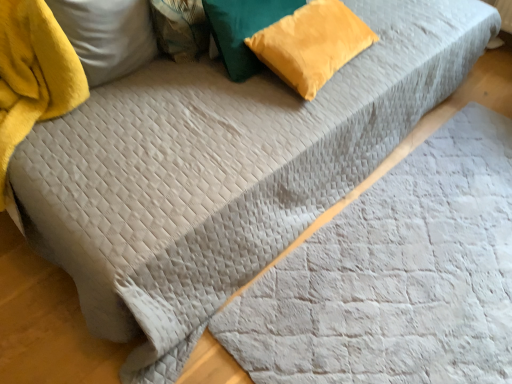
This screenshot has width=512, height=384. I want to click on gray quilted blanket at center, so click(x=396, y=276).

You are a GUI agent. You are given a task and a screenshot of the screen. Output one action in this format:
    pyautogui.click(x=<x>, y=<y>)
    Task: Click on the velvet yellow pillow at upper right, which is the first pillow from right to left
    
    Given the screenshot: What is the action you would take?
    pyautogui.click(x=311, y=44)

The height and width of the screenshot is (384, 512). I want to click on gray quilted blanket at center, so click(x=396, y=276).

Relative to gray quilted blanket at center, is velvet yellow pillow at upper right, positioned as the third pillow in left-to-right order, in front or behind?

velvet yellow pillow at upper right, positioned as the third pillow in left-to-right order, is behind gray quilted blanket at center.

Can you tell me how much velvet yellow pillow at upper right, which is the first pillow from right to left, and gray quilted blanket at center differ in facing direction?

173 degrees.

Does velvet yellow pillow at upper right, positioned as the third pillow in left-to-right order, turn towards gray quilted blanket at center?

No, velvet yellow pillow at upper right, positioned as the third pillow in left-to-right order, is not turned towards gray quilted blanket at center.

Choose the correct answer: Is velvet yellow pillow at upper right, positioned as the third pillow in left-to-right order, inside gray quilted blanket at center or outside it?

velvet yellow pillow at upper right, positioned as the third pillow in left-to-right order, is outside gray quilted blanket at center.

Considering the sizes of objects velvet yellow pillow at upper center, the 2th pillow in the left-to-right sequence, and yellow velvet pillow at upper left, acting as the 1th pillow starting from the left, in the image provided, who is thinner, velvet yellow pillow at upper center, the 2th pillow in the left-to-right sequence, or yellow velvet pillow at upper left, acting as the 1th pillow starting from the left,?

Thinner between the two is velvet yellow pillow at upper center, the 2th pillow in the left-to-right sequence.

Is velvet yellow pillow at upper center, the 2th pillow viewed from the right, positioned beyond the bounds of yellow velvet pillow at upper left, the third pillow viewed from the right?

Yes.

Is velvet yellow pillow at upper center, the 2th pillow viewed from the right, smaller than yellow velvet pillow at upper left, acting as the 1th pillow starting from the left?

Yes.

Can you tell me how much velvet yellow pillow at upper center, the 2th pillow viewed from the right, and yellow velvet pillow at upper left, the third pillow viewed from the right, differ in facing direction?

10.5 degrees.

Which object is positioned more to the right, gray quilted blanket at center or velvet yellow pillow at upper center, the 2th pillow in the left-to-right sequence?

gray quilted blanket at center.

Which is in front, point (333, 239) or point (237, 36)?

The point (237, 36) is more forward.

From the image's perspective, who appears lower, gray quilted blanket at center or velvet yellow pillow at upper center, the 2th pillow viewed from the right?

gray quilted blanket at center appears lower in the image.

Is velvet yellow pillow at upper right, which is the first pillow from right to left, oriented away from velvet yellow pillow at upper center, the 2th pillow viewed from the right?

Yes.

Is velvet yellow pillow at upper right, which is the first pillow from right to left, outside of velvet yellow pillow at upper center, the 2th pillow viewed from the right?

Indeed, velvet yellow pillow at upper right, which is the first pillow from right to left, is completely outside velvet yellow pillow at upper center, the 2th pillow viewed from the right.

Between yellow velvet pillow at upper left, acting as the 1th pillow starting from the left, and velvet yellow pillow at upper center, the 2th pillow in the left-to-right sequence, which one has larger size?

With larger size is yellow velvet pillow at upper left, acting as the 1th pillow starting from the left.

Considering the sizes of objects yellow velvet pillow at upper left, the third pillow viewed from the right, and velvet yellow pillow at upper center, the 2th pillow in the left-to-right sequence, in the image provided, who is taller, yellow velvet pillow at upper left, the third pillow viewed from the right, or velvet yellow pillow at upper center, the 2th pillow in the left-to-right sequence,?

yellow velvet pillow at upper left, the third pillow viewed from the right.

Between yellow velvet pillow at upper left, acting as the 1th pillow starting from the left, and velvet yellow pillow at upper center, the 2th pillow in the left-to-right sequence, which one has smaller width?

velvet yellow pillow at upper center, the 2th pillow in the left-to-right sequence.

Is point (100, 56) positioned after point (281, 4)?

That is False.

Is velvet yellow pillow at upper center, the 2th pillow viewed from the right, in front of or behind velvet yellow pillow at upper right, positioned as the third pillow in left-to-right order, in the image?

velvet yellow pillow at upper center, the 2th pillow viewed from the right, is positioned closer to the viewer than velvet yellow pillow at upper right, positioned as the third pillow in left-to-right order.

Do you think velvet yellow pillow at upper center, the 2th pillow in the left-to-right sequence, is within velvet yellow pillow at upper right, which is the first pillow from right to left, or outside of it?

velvet yellow pillow at upper center, the 2th pillow in the left-to-right sequence, is spatially situated outside velvet yellow pillow at upper right, which is the first pillow from right to left.

Between velvet yellow pillow at upper center, the 2th pillow viewed from the right, and velvet yellow pillow at upper right, which is the first pillow from right to left, which one appears on the right side from the viewer's perspective?

From the viewer's perspective, velvet yellow pillow at upper right, which is the first pillow from right to left, appears more on the right side.

Is velvet yellow pillow at upper center, the 2th pillow in the left-to-right sequence, oriented away from velvet yellow pillow at upper right, positioned as the third pillow in left-to-right order?

Yes, velvet yellow pillow at upper center, the 2th pillow in the left-to-right sequence, is positioned with its back facing velvet yellow pillow at upper right, positioned as the third pillow in left-to-right order.

From the image's perspective, is yellow velvet pillow at upper left, acting as the 1th pillow starting from the left, below gray quilted blanket at center?

Actually, yellow velvet pillow at upper left, acting as the 1th pillow starting from the left, appears above gray quilted blanket at center in the image.

Is yellow velvet pillow at upper left, acting as the 1th pillow starting from the left, far away from gray quilted blanket at center?

That's right, there is a large distance between yellow velvet pillow at upper left, acting as the 1th pillow starting from the left, and gray quilted blanket at center.

Between yellow velvet pillow at upper left, acting as the 1th pillow starting from the left, and gray quilted blanket at center, which one has smaller size?

yellow velvet pillow at upper left, acting as the 1th pillow starting from the left, is smaller.

Is yellow velvet pillow at upper left, acting as the 1th pillow starting from the left, facing towards gray quilted blanket at center?

No, yellow velvet pillow at upper left, acting as the 1th pillow starting from the left, is not facing towards gray quilted blanket at center.

Starting from the gray quilted blanket at center, which pillow is the 1st one to the left? Please provide its 2D coordinates.

[(311, 44)]

You are a GUI agent. You are given a task and a screenshot of the screen. Output one action in this format:
    pyautogui.click(x=<x>, y=<y>)
    Task: Click on the pillow positioned vertically above the velvet yellow pillow at upper center, the 2th pillow viewed from the right (from a real-world perspective)
    This screenshot has width=512, height=384.
    Given the screenshot: What is the action you would take?
    pyautogui.click(x=106, y=35)

Considering their positions, is velvet yellow pillow at upper right, which is the first pillow from right to left, positioned further to velvet yellow pillow at upper center, the 2th pillow viewed from the right, than gray quilted blanket at center?

gray quilted blanket at center.

Which object lies nearer to the anchor point yellow velvet pillow at upper left, the third pillow viewed from the right, velvet yellow pillow at upper right, which is the first pillow from right to left, or gray quilted blanket at center?

Among the two, velvet yellow pillow at upper right, which is the first pillow from right to left, is located nearer to yellow velvet pillow at upper left, the third pillow viewed from the right.

Consider the image. From the image, which object appears to be nearer to velvet yellow pillow at upper center, the 2th pillow in the left-to-right sequence, yellow velvet pillow at upper left, the third pillow viewed from the right, or gray quilted blanket at center?

yellow velvet pillow at upper left, the third pillow viewed from the right, lies closer to velvet yellow pillow at upper center, the 2th pillow in the left-to-right sequence, than the other object.

Considering their positions, is yellow velvet pillow at upper left, the third pillow viewed from the right, positioned further to velvet yellow pillow at upper right, positioned as the third pillow in left-to-right order, than velvet yellow pillow at upper center, the 2th pillow in the left-to-right sequence?

yellow velvet pillow at upper left, the third pillow viewed from the right, is positioned further to the anchor velvet yellow pillow at upper right, positioned as the third pillow in left-to-right order.

From the image, which object appears to be nearer to velvet yellow pillow at upper right, which is the first pillow from right to left, yellow velvet pillow at upper left, acting as the 1th pillow starting from the left, or gray quilted blanket at center?

Based on the image, yellow velvet pillow at upper left, acting as the 1th pillow starting from the left, appears to be nearer to velvet yellow pillow at upper right, which is the first pillow from right to left.

Estimate the real-world distances between objects in this image. Which object is closer to velvet yellow pillow at upper center, the 2th pillow in the left-to-right sequence, velvet yellow pillow at upper right, which is the first pillow from right to left, or yellow velvet pillow at upper left, the third pillow viewed from the right?

velvet yellow pillow at upper right, which is the first pillow from right to left, is positioned closer to the anchor velvet yellow pillow at upper center, the 2th pillow in the left-to-right sequence.

Which object lies further to the anchor point yellow velvet pillow at upper left, acting as the 1th pillow starting from the left, gray quilted blanket at center or velvet yellow pillow at upper center, the 2th pillow viewed from the right?

gray quilted blanket at center lies further to yellow velvet pillow at upper left, acting as the 1th pillow starting from the left, than the other object.

From the image, which object appears to be farther from gray quilted blanket at center, velvet yellow pillow at upper right, which is the first pillow from right to left, or yellow velvet pillow at upper left, acting as the 1th pillow starting from the left?

Based on the image, yellow velvet pillow at upper left, acting as the 1th pillow starting from the left, appears to be further to gray quilted blanket at center.

Locate an element on the screen. pillow located between yellow velvet pillow at upper left, the third pillow viewed from the right, and velvet yellow pillow at upper right, which is the first pillow from right to left, in the left-right direction is located at coordinates (243, 30).